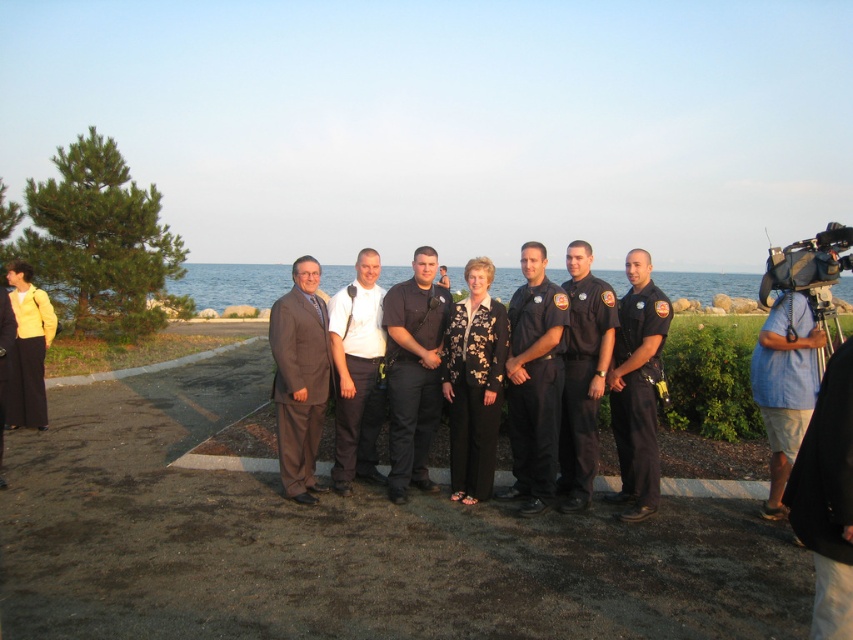
You are a photographer trying to capture a photo of the dark blue uniform at center and the blue shirt at right. Based on their positions, which one would appear higher in the photo?

The dark blue uniform at center appears higher in the photo because it is located above the blue shirt at right.

Based on the scene description, where is the brown suit at center located in terms of coordinates?

The brown suit at center is located at point coordinates of (299, 378).